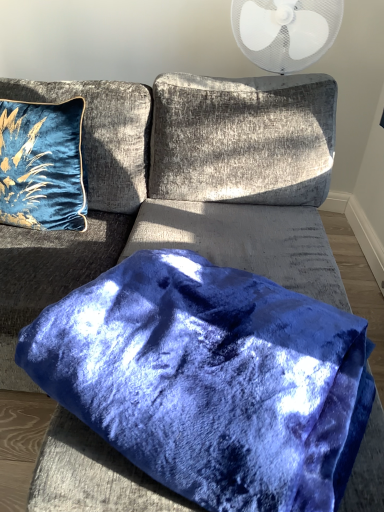
Question: Is velvet blue couch at center wider or thinner than velvet blue pillow at center, acting as the second pillow starting from the left?

Choices:
 (A) thin
 (B) wide

Answer: (B)

Question: Is velvet blue couch at center bigger or smaller than velvet blue pillow at center, arranged as the 2th pillow when viewed from the top?

Choices:
 (A) small
 (B) big

Answer: (B)

Question: Which is nearer to the velvet blue pillow at center, the first pillow from the front?

Choices:
 (A) velvet blue pillow at upper left, the 2th pillow from the front
 (B) velvet blue couch at center

Answer: (B)

Question: Which object is positioned farthest from the velvet blue couch at center?

Choices:
 (A) velvet blue pillow at upper left, which appears as the first pillow when viewed from the back
 (B) velvet blue pillow at center, the second pillow from the back

Answer: (B)